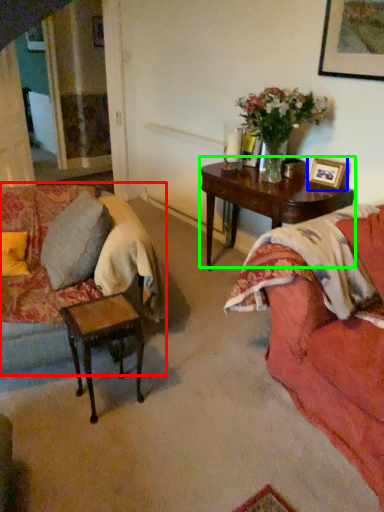
Question: Which is nearer to the studio couch (highlighted by a red box)? picture frame (highlighted by a blue box) or coffee table (highlighted by a green box).

Choices:
 (A) picture frame
 (B) coffee table

Answer: (B)